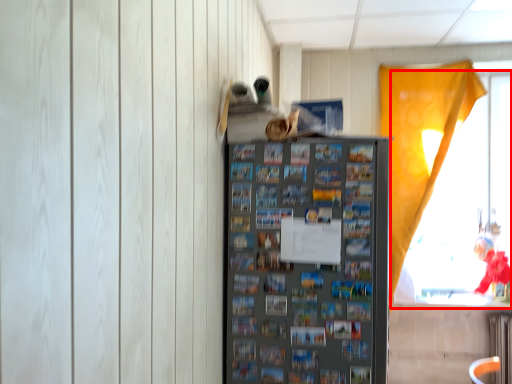
Question: From the image's perspective, what is the correct spatial positioning of window (annotated by the red box) in reference to shelf?

Choices:
 (A) below
 (B) above

Answer: (B)